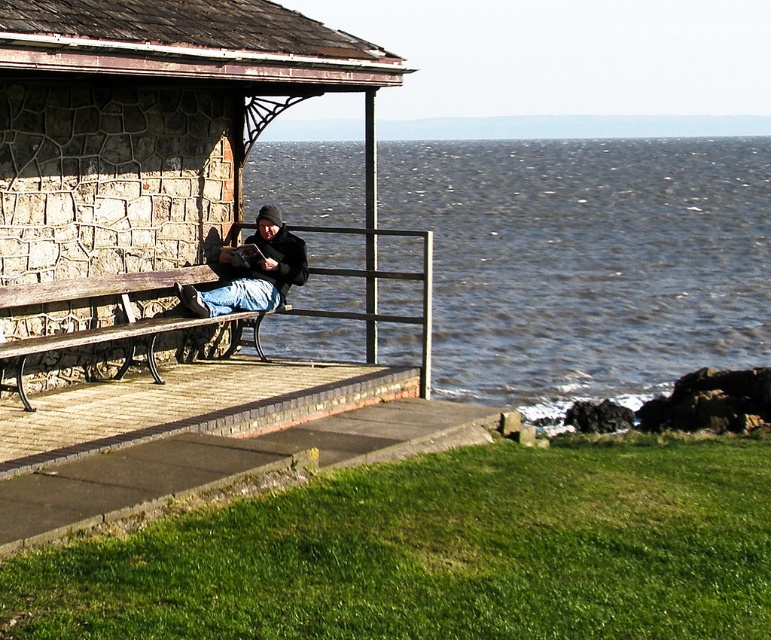
You are a photographer wanting to capture the stone textured bench at left and the jeans at center in a single shot. Based on their positions, can you determine if the bench will block the view of the jeans in the photo?

The stone textured bench at left is positioned over jeans at center, so the bench will block the view of the jeans in the photo.

You are a photographer planning to take a photo of the wooden bench at left and the jeans at center. If you want to ensure both objects are clearly visible in the frame, which object should you focus on first to maintain sharpness?

The wooden bench at left has a larger size compared to jeans at center, so you should focus on the wooden bench at left first to ensure both objects are in focus since it is larger and occupies more space in the frame.